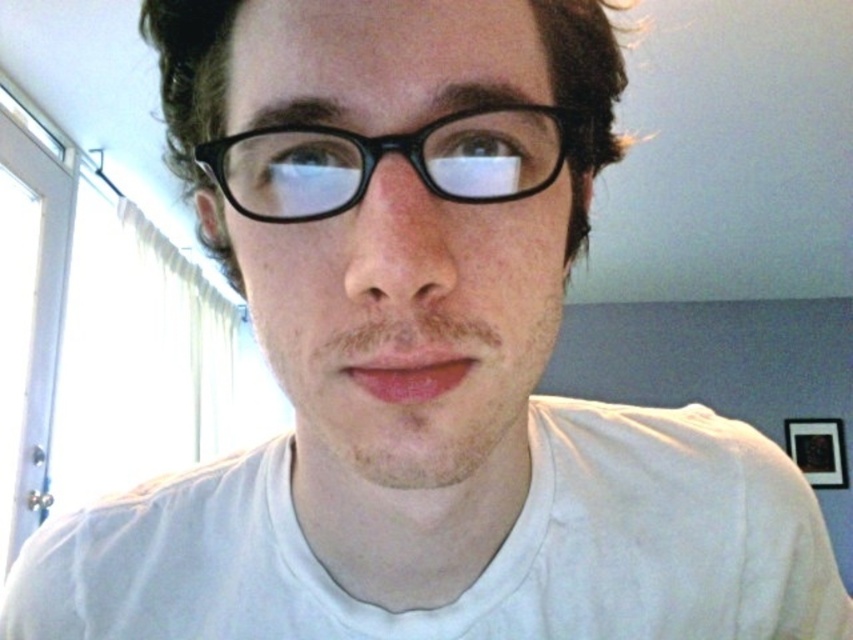
Between white cotton t-shirt at center and black plastic glasses at center, which one has more height?

white cotton t-shirt at center

Measure the distance between point (36, 621) and camera.

They are 17.08 inches apart.

The height and width of the screenshot is (640, 853). What are the coordinates of `white cotton t-shirt at center` in the screenshot? It's located at (486, 564).

This screenshot has width=853, height=640. Identify the location of white cotton t-shirt at center. (486, 564).